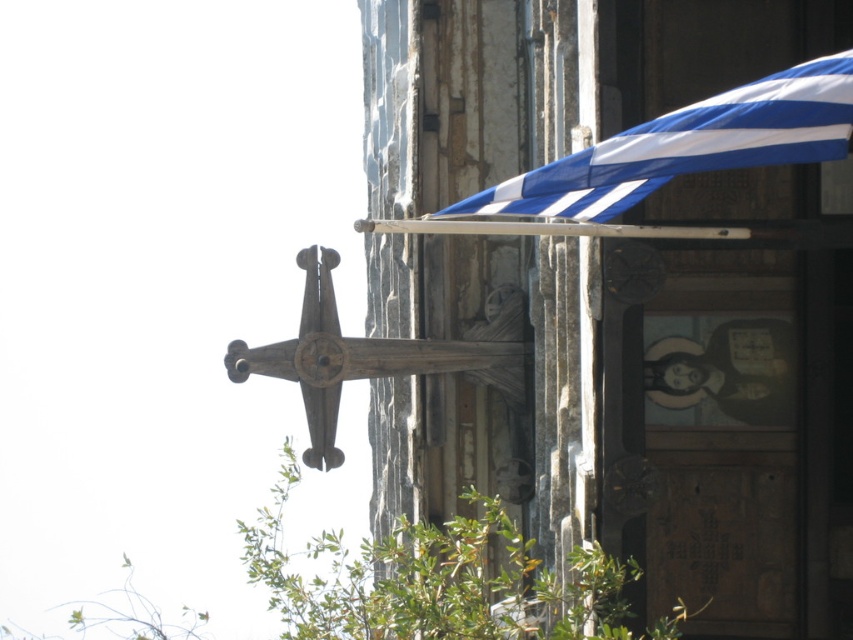
Question: Which of the following is the closest to the observer?

Choices:
 (A) wooden cross at center
 (B) blue striped awning at upper right

Answer: (B)

Question: Is blue striped awning at upper right to the right of wooden cross at center from the viewer's perspective?

Choices:
 (A) yes
 (B) no

Answer: (A)

Question: Does blue striped awning at upper right have a greater width compared to wooden cross at center?

Choices:
 (A) yes
 (B) no

Answer: (A)

Question: Among these points, which one is nearest to the camera?

Choices:
 (A) (323, 292)
 (B) (850, 108)

Answer: (B)

Question: Which point appears farthest from the camera in this image?

Choices:
 (A) (302, 317)
 (B) (599, 177)

Answer: (A)

Question: Is blue striped awning at upper right to the right of wooden cross at center from the viewer's perspective?

Choices:
 (A) yes
 (B) no

Answer: (A)